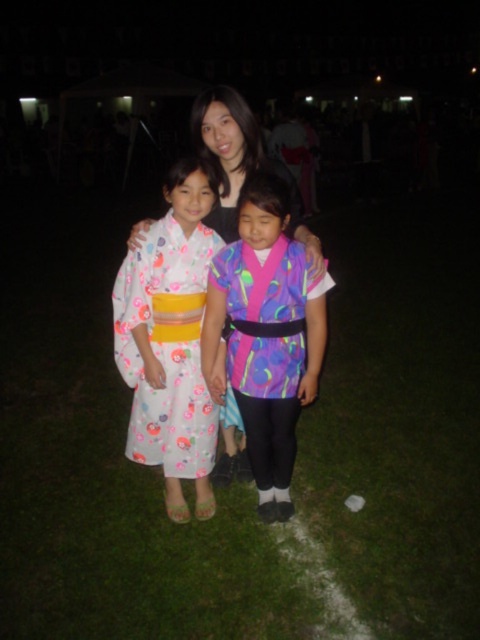
Is green grass at center positioned behind neon fabric kimono at center?

No, green grass at center is in front of neon fabric kimono at center.

In the scene shown: Does green grass at center have a greater height compared to neon fabric kimono at center?

Correct, green grass at center is much taller as neon fabric kimono at center.

Where is `green grass at center`? The width and height of the screenshot is (480, 640). green grass at center is located at coordinates (105, 467).

Is point (297, 268) positioned before point (140, 221)?

Yes, it is.

Is neon fabric kimono at center taller than matte black kimono at center?

Yes, neon fabric kimono at center is taller than matte black kimono at center.

Between point (279, 346) and point (205, 134), which one is positioned behind?

Positioned behind is point (205, 134).

Locate an element on the screen. This screenshot has width=480, height=640. neon fabric kimono at center is located at coordinates (266, 333).

Consider the image. Which is more to the left, neon fabric kimono at center or floral silk kimono at center?

Positioned to the left is floral silk kimono at center.

Between neon fabric kimono at center and floral silk kimono at center, which one appears on the right side from the viewer's perspective?

neon fabric kimono at center

Image resolution: width=480 pixels, height=640 pixels. What do you see at coordinates (266, 333) in the screenshot?
I see `neon fabric kimono at center` at bounding box center [266, 333].

I want to click on neon fabric kimono at center, so click(266, 333).